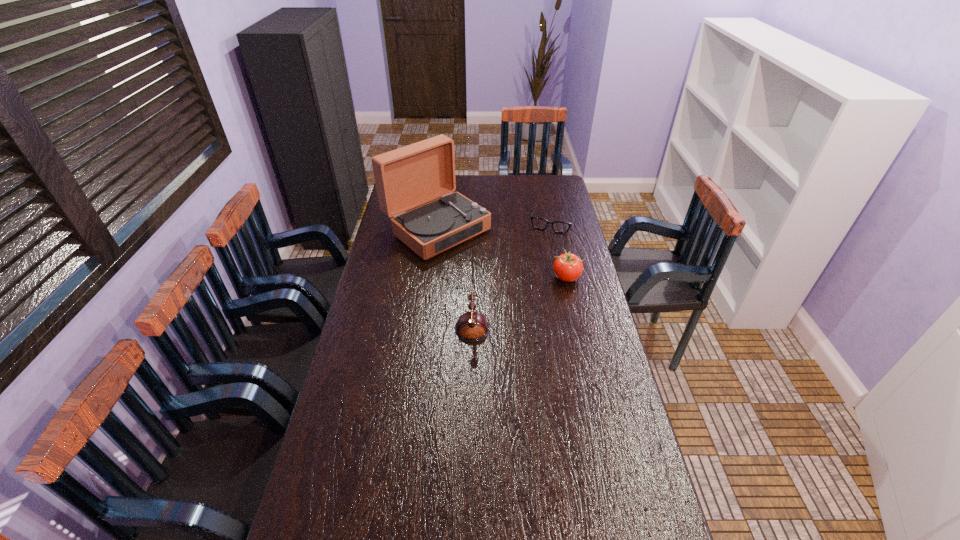
Where is `vacant region at the near left corner of the desktop`? This screenshot has height=540, width=960. vacant region at the near left corner of the desktop is located at coordinates (327, 514).

Image resolution: width=960 pixels, height=540 pixels. I want to click on blank space at the far right corner of the desktop, so coord(555,195).

In order to click on vacant point located between the phonograph record and the tomato in this screenshot , I will do `click(501, 253)`.

Locate an element on the screen. The image size is (960, 540). blank region between the tallest object and the spectacles is located at coordinates (494, 225).

Identify the location of free space between the telephone and the phonograph record. This screenshot has width=960, height=540. (451, 272).

Identify the location of free space between the phonograph record and the telephone. Image resolution: width=960 pixels, height=540 pixels. (451, 272).

Image resolution: width=960 pixels, height=540 pixels. What are the coordinates of `free spot between the shortest object and the telephone` in the screenshot? It's located at (510, 268).

Locate an element on the screen. Image resolution: width=960 pixels, height=540 pixels. free space between the telephone and the tomato is located at coordinates (516, 296).

At what (x,y) coordinates should I click in order to perform the action: click on free space between the shortest object and the telephone. Please return your answer as a coordinate pair (x, y). The image size is (960, 540). Looking at the image, I should click on (510, 268).

The image size is (960, 540). I want to click on free space between the tomato and the telephone, so click(516, 296).